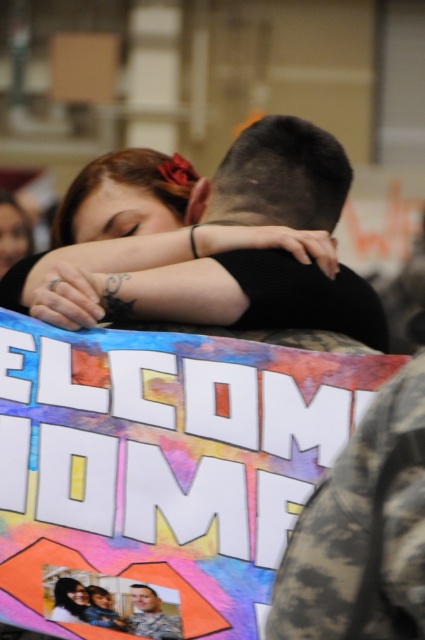
Question: Which object is closer to the camera taking this photo?

Choices:
 (A) matte black hair at upper left
 (B) camouflage uniform at center
 (C) dark brown hair at upper center

Answer: (A)

Question: Which point is farther from the camera taking this photo?

Choices:
 (A) (146, 588)
 (B) (269, 266)
 (C) (88, 596)

Answer: (B)

Question: Does dark brown hair at upper center have a smaller size compared to matte black hair at upper left?

Choices:
 (A) yes
 (B) no

Answer: (B)

Question: Is dark brown hair at upper center bigger than matte black hair at upper left?

Choices:
 (A) no
 (B) yes

Answer: (B)

Question: Is dark brown hair at upper center to the right of camouflage uniform at center from the viewer's perspective?

Choices:
 (A) yes
 (B) no

Answer: (A)

Question: Considering the real-world distances, which object is closest to the dark brown hair at upper center?

Choices:
 (A) camouflage uniform at center
 (B) matte black hair at upper left

Answer: (A)